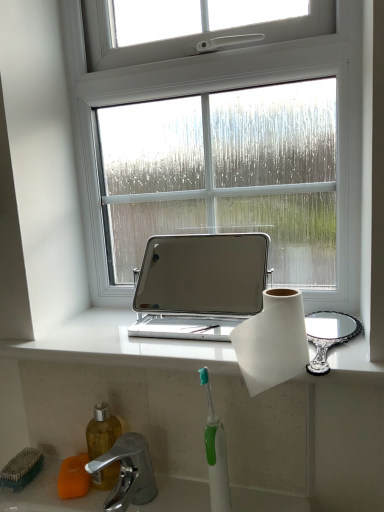
Question: Could you tell me if white marble window sill at center is facing orange sponge at lower left?

Choices:
 (A) yes
 (B) no

Answer: (B)

Question: Is white marble window sill at center facing away from orange sponge at lower left?

Choices:
 (A) yes
 (B) no

Answer: (B)

Question: From a real-world perspective, is white marble window sill at center physically below orange sponge at lower left?

Choices:
 (A) no
 (B) yes

Answer: (A)

Question: Is white marble window sill at center to the right of orange sponge at lower left from the viewer's perspective?

Choices:
 (A) yes
 (B) no

Answer: (A)

Question: Is white marble window sill at center not close to orange sponge at lower left?

Choices:
 (A) yes
 (B) no

Answer: (B)

Question: Considering the positions of silver metallic laptop at center and white paper at center in the image, is silver metallic laptop at center wider or thinner than white paper at center?

Choices:
 (A) thin
 (B) wide

Answer: (B)

Question: Is silver metallic laptop at center taller or shorter than white paper at center?

Choices:
 (A) short
 (B) tall

Answer: (B)

Question: Considering their positions, is silver metallic laptop at center located in front of or behind white paper at center?

Choices:
 (A) behind
 (B) front

Answer: (A)

Question: Would you say silver metallic laptop at center is to the left or to the right of white paper at center in the picture?

Choices:
 (A) left
 (B) right

Answer: (A)

Question: Is point (210, 406) closer or farther from the camera than point (67, 333)?

Choices:
 (A) closer
 (B) farther

Answer: (A)

Question: Considering the positions of green plastic toothbrush at lower center and white marble window sill at center in the image, is green plastic toothbrush at lower center taller or shorter than white marble window sill at center?

Choices:
 (A) short
 (B) tall

Answer: (B)

Question: Considering the positions of green plastic toothbrush at lower center and white marble window sill at center in the image, is green plastic toothbrush at lower center wider or thinner than white marble window sill at center?

Choices:
 (A) thin
 (B) wide

Answer: (A)

Question: Based on their sizes in the image, would you say green plastic toothbrush at lower center is bigger or smaller than white marble window sill at center?

Choices:
 (A) big
 (B) small

Answer: (B)

Question: From the image's perspective, is white paper at center located above or below silver metallic laptop at center?

Choices:
 (A) below
 (B) above

Answer: (A)

Question: Is point click(292, 300) closer or farther from the camera than point click(177, 331)?

Choices:
 (A) farther
 (B) closer

Answer: (B)